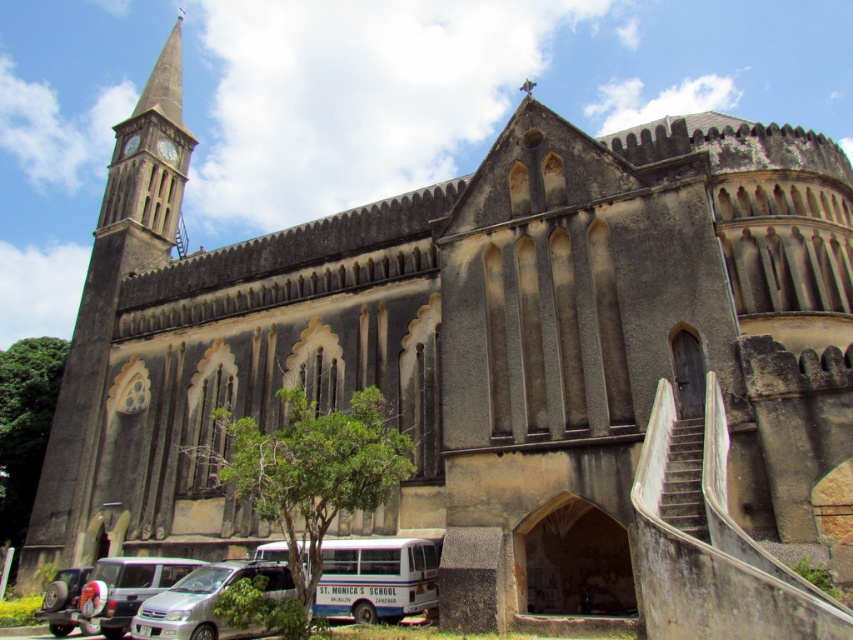
You are a delivery person trying to park your van between the white matte bus at lower center and the silver metallic car at lower left. Given that your van is 6 meters long, can you fit it in the available space between them?

The white matte bus at lower center occupies less space than the silver metallic car at lower left. However, without knowing the exact distance between them, it is impossible to determine if the van will fit. Please check the available space before attempting to park.

You are a pedestrian standing in front of the historic church and want to cross the street. You see a white matte bus at lower center and a silver metallic van at lower left. Which vehicle is closer to you?

The white matte bus at lower center is closer to you because it is further to the viewer than the silver metallic van at lower left.